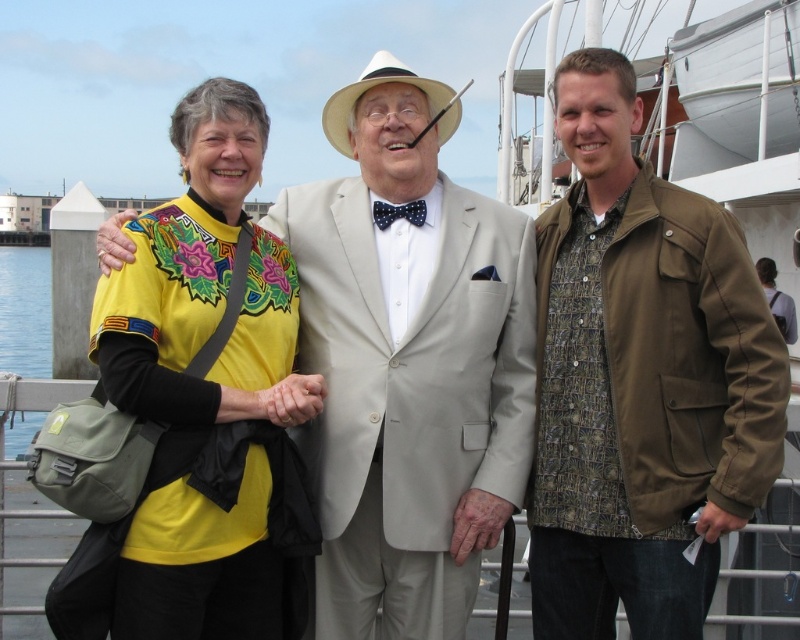
Can you confirm if light beige suit at center is wider than matte yellow shirt at center?

Yes, light beige suit at center is wider than matte yellow shirt at center.

Where is `light beige suit at center`? light beige suit at center is located at coordinates (408, 362).

This screenshot has width=800, height=640. I want to click on light beige suit at center, so click(x=408, y=362).

Who is more distant from viewer, (624, 401) or (346, 636)?

The point (346, 636) is more distant.

Between olive-green canvas jacket at right and light beige suit at center, which one is positioned higher?

Positioned higher is olive-green canvas jacket at right.

Is point (536, 234) farther from camera compared to point (474, 227)?

Yes, it is.

Where is `olive-green canvas jacket at right`? This screenshot has height=640, width=800. olive-green canvas jacket at right is located at coordinates (640, 380).

Is olive-green canvas jacket at right to the left of white felt cowboy hat at center from the viewer's perspective?

No, olive-green canvas jacket at right is not to the left of white felt cowboy hat at center.

You are a GUI agent. You are given a task and a screenshot of the screen. Output one action in this format:
    pyautogui.click(x=<x>, y=<y>)
    Task: Click on the olive-green canvas jacket at right
    
    Given the screenshot: What is the action you would take?
    pyautogui.click(x=640, y=380)

Find the location of a particular element. The image size is (800, 640). olive-green canvas jacket at right is located at coordinates (640, 380).